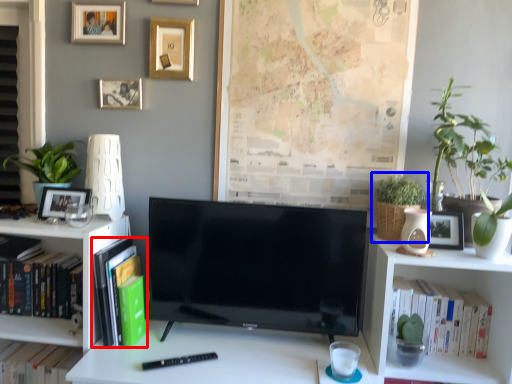
Question: Which object appears farthest to the camera in this image, book (highlighted by a red box) or houseplant (highlighted by a blue box)?

Choices:
 (A) book
 (B) houseplant

Answer: (B)